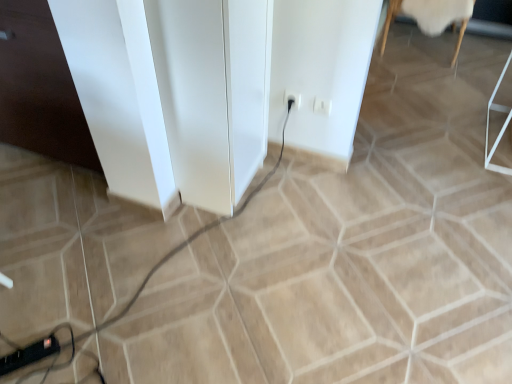
Question: Considering the relative sizes of black rubber cable at lower left and white plastic socket at center in the image provided, is black rubber cable at lower left smaller than white plastic socket at center?

Choices:
 (A) yes
 (B) no

Answer: (B)

Question: Does black rubber cable at lower left lie behind white plastic socket at center?

Choices:
 (A) no
 (B) yes

Answer: (A)

Question: Considering the relative positions of black rubber cable at lower left and white plastic socket at center in the image provided, is black rubber cable at lower left to the left of white plastic socket at center from the viewer's perspective?

Choices:
 (A) yes
 (B) no

Answer: (A)

Question: Is the surface of black rubber cable at lower left in direct contact with white plastic socket at center?

Choices:
 (A) no
 (B) yes

Answer: (A)

Question: Is the depth of black rubber cable at lower left less than that of white plastic socket at center?

Choices:
 (A) yes
 (B) no

Answer: (A)

Question: From the image's perspective, is black rubber cable at lower left under white plastic socket at center?

Choices:
 (A) yes
 (B) no

Answer: (A)

Question: Could you tell me if white glossy file cabinet at left, placed as the second file cabinet when sorted from right to left, is turned towards white glossy file cabinet at center, the second file cabinet from the left?

Choices:
 (A) yes
 (B) no

Answer: (B)

Question: Could white glossy file cabinet at center, acting as the 1th file cabinet starting from the right, be considered to be inside white glossy file cabinet at left, the 1th file cabinet positioned from the left?

Choices:
 (A) no
 (B) yes

Answer: (A)

Question: From the image's perspective, is white glossy file cabinet at left, placed as the second file cabinet when sorted from right to left, over white glossy file cabinet at center, acting as the 1th file cabinet starting from the right?

Choices:
 (A) yes
 (B) no

Answer: (A)

Question: Can you confirm if white glossy file cabinet at left, placed as the second file cabinet when sorted from right to left, is thinner than white glossy file cabinet at center, acting as the 1th file cabinet starting from the right?

Choices:
 (A) no
 (B) yes

Answer: (A)

Question: Is white glossy file cabinet at left, the 1th file cabinet positioned from the left, touching white glossy file cabinet at center, acting as the 1th file cabinet starting from the right?

Choices:
 (A) no
 (B) yes

Answer: (A)

Question: From a real-world perspective, does white glossy file cabinet at left, placed as the second file cabinet when sorted from right to left, stand above white glossy file cabinet at center, acting as the 1th file cabinet starting from the right?

Choices:
 (A) no
 (B) yes

Answer: (A)

Question: Can you confirm if white woolen rug at upper right is smaller than white plastic electric outlet at center-right?

Choices:
 (A) no
 (B) yes

Answer: (A)